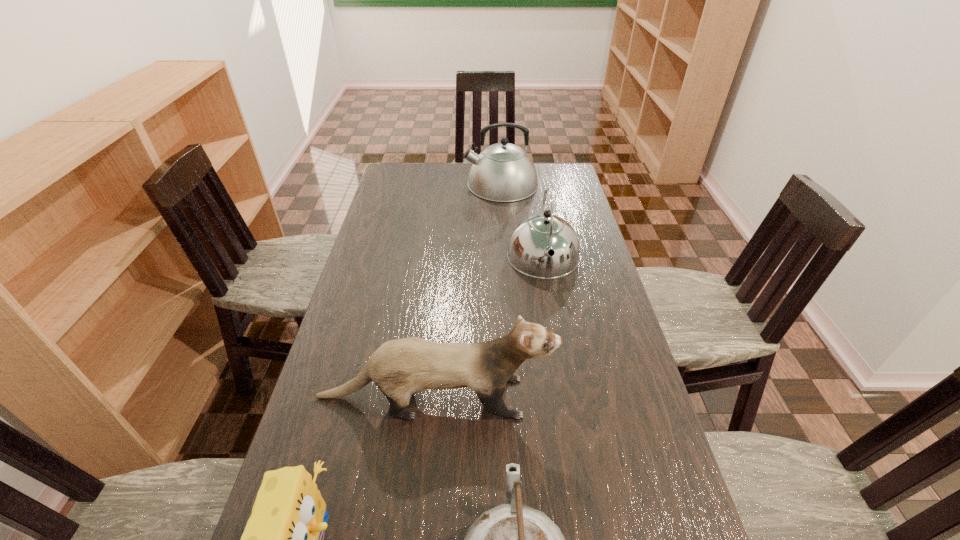
The image size is (960, 540). I want to click on object present at the right edge, so click(532, 239).

In the image, there is a desktop. Find the location of `free space at the left edge`. free space at the left edge is located at coordinates (397, 245).

In the image, there is a desktop. Where is `vacant region at the right edge`? The image size is (960, 540). vacant region at the right edge is located at coordinates (584, 238).

Where is `free spot at the far left corner of the desktop`? The image size is (960, 540). free spot at the far left corner of the desktop is located at coordinates (405, 166).

You are a GUI agent. You are given a task and a screenshot of the screen. Output one action in this format:
    pyautogui.click(x=<x>, y=<y>)
    Task: Click on the free area in between the farthest kettle and the third farthest object
    
    Given the screenshot: What is the action you would take?
    pyautogui.click(x=468, y=291)

Find the location of a particular element. The width and height of the screenshot is (960, 540). object that is the second closest to the third farthest object is located at coordinates (512, 539).

Find the location of `the second closest object to the farthest kettle`. the second closest object to the farthest kettle is located at coordinates (401, 367).

Find the location of a particular element. The image size is (960, 540). kettle identified as the closest to the nearest kettle is located at coordinates (532, 239).

Identify which kettle is located as the third nearest to the ferret. Please provide its 2D coordinates. Your answer should be formatted as a tuple, i.e. [(x, y)], where the tuple contains the x and y coordinates of a point satisfying the conditions above.

[(503, 172)]

Find the location of a particular element. The height and width of the screenshot is (540, 960). vacant region that satisfies the following two spatial constraints: 1. from the spout of the second farthest kettle; 2. on the face of the ferret is located at coordinates (567, 397).